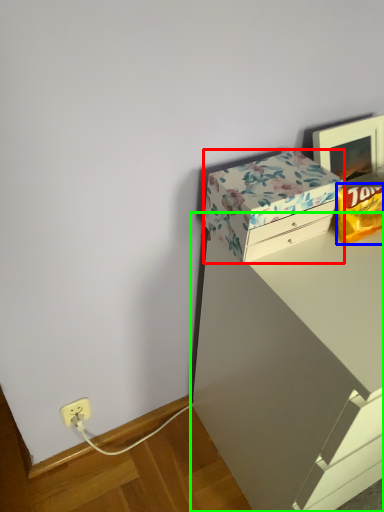
Question: Considering the real-world distances, which object is farthest from box (highlighted by a red box)? wrapping paper (highlighted by a blue box) or vanity (highlighted by a green box)?

Choices:
 (A) wrapping paper
 (B) vanity

Answer: (B)